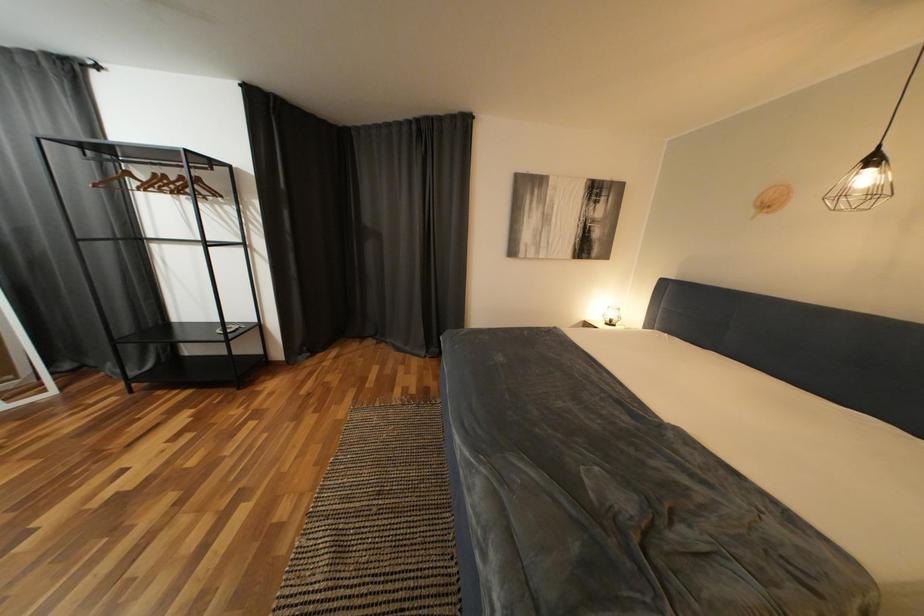
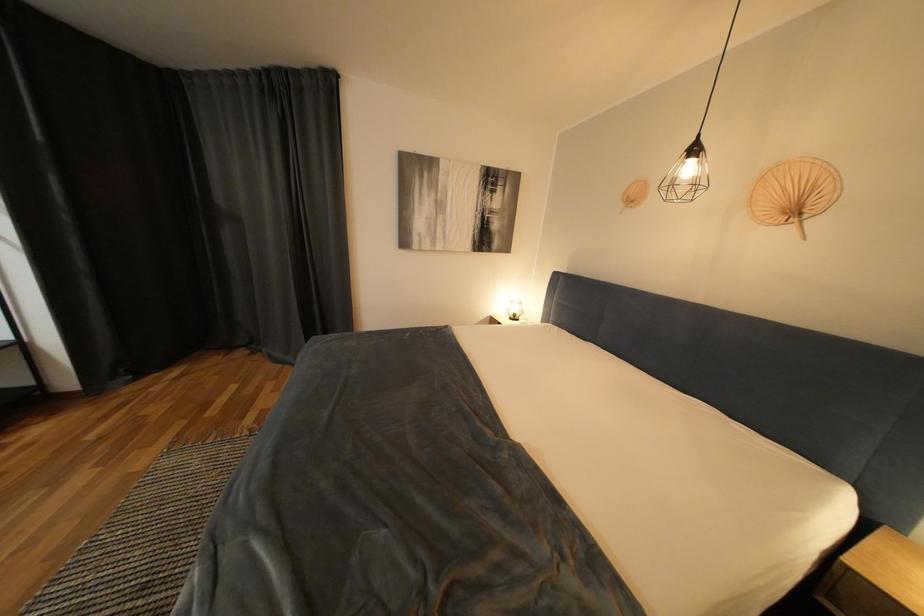
Which direction would the cameraman need to move to produce the second image?

The cameraman moved toward right, forward.